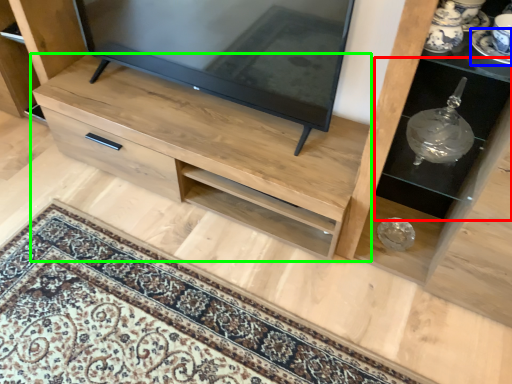
Question: Which is farther away from shelf (highlighted by a red box)? saucer (highlighted by a blue box) or chest of drawers (highlighted by a green box)?

Choices:
 (A) saucer
 (B) chest of drawers

Answer: (B)